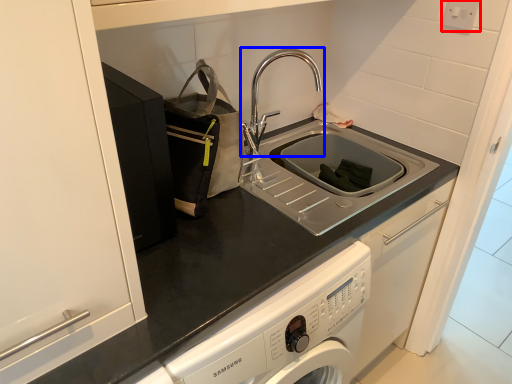
Question: Which object is closer to the camera taking this photo, electric outlet (highlighted by a red box) or tap (highlighted by a blue box)?

Choices:
 (A) electric outlet
 (B) tap

Answer: (B)